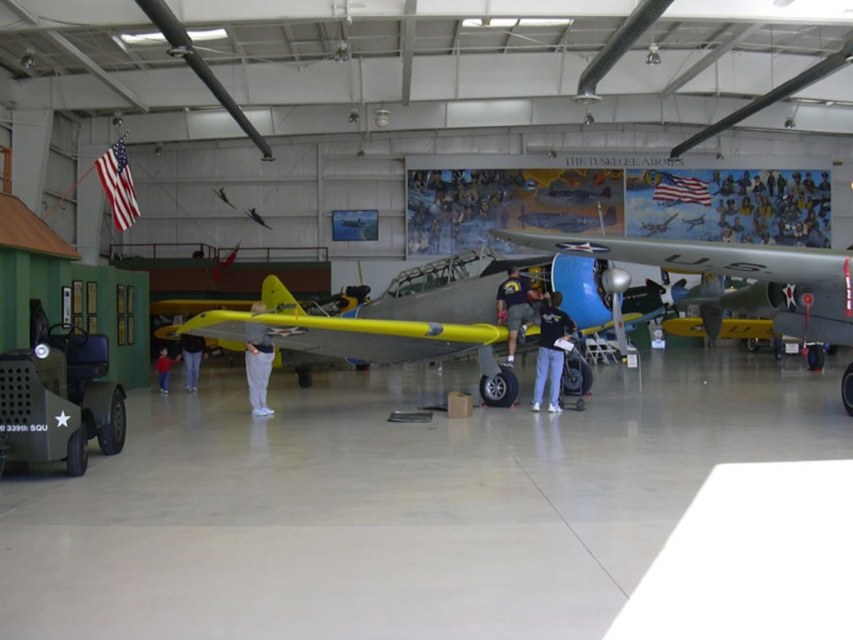
Does yellow matte airplane at center have a lesser width compared to matte silver airplane at center?

No, yellow matte airplane at center is not thinner than matte silver airplane at center.

Identify the location of yellow matte airplane at center. The width and height of the screenshot is (853, 640). (384, 323).

Which of these two, dark blue jeans at center or matte yellow airplane at center, stands shorter?

Standing shorter between the two is matte yellow airplane at center.

Measure the distance between point [546,320] and camera.

Point [546,320] is 33.76 feet away from camera.

Between point (541, 336) and point (521, 324), which one is positioned in front?

Positioned in front is point (541, 336).

Find the location of a particular element. The height and width of the screenshot is (640, 853). dark blue jeans at center is located at coordinates (550, 352).

Does point (190, 355) come closer to viewer compared to point (158, 364)?

That is False.

Which of these two, light gray pants at center or red cotton shirt at lower left, stands shorter?

red cotton shirt at lower left is shorter.

Where is `light gray pants at center`? light gray pants at center is located at coordinates (190, 358).

At what (x,y) coordinates should I click in order to perform the action: click on light gray pants at center. Please return your answer as a coordinate pair (x, y). The width and height of the screenshot is (853, 640). Looking at the image, I should click on (190, 358).